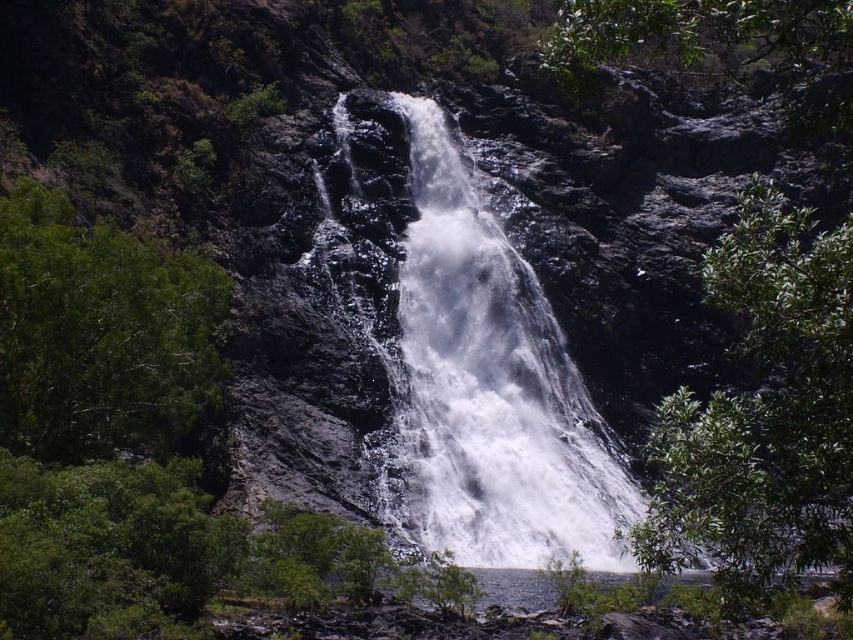
Is white frothy water at center bigger than green leafy tree at right?

No, white frothy water at center is not bigger than green leafy tree at right.

Does white frothy water at center lie behind green leafy tree at right?

Yes, it is.

Between point (427, 147) and point (732, 540), which one is positioned behind?

The point (427, 147) is more distant.

Where is `white frothy water at center`? white frothy water at center is located at coordinates (489, 387).

Locate an element on the screen. The height and width of the screenshot is (640, 853). white frothy water at center is located at coordinates (489, 387).

Can you confirm if white frothy water at center is bigger than green leafy tree at left?

Yes.

Image resolution: width=853 pixels, height=640 pixels. What are the coordinates of `white frothy water at center` in the screenshot? It's located at (489, 387).

You are a GUI agent. You are given a task and a screenshot of the screen. Output one action in this format:
    pyautogui.click(x=<x>, y=<y>)
    Task: Click on the white frothy water at center
    This screenshot has width=853, height=640.
    Given the screenshot: What is the action you would take?
    pyautogui.click(x=489, y=387)

Does green leafy tree at right have a smaller size compared to green leafy tree at left?

Actually, green leafy tree at right might be larger than green leafy tree at left.

Measure the distance between green leafy tree at right and camera.

They are 102.87 feet apart.

The width and height of the screenshot is (853, 640). What are the coordinates of `green leafy tree at right` in the screenshot? It's located at (764, 417).